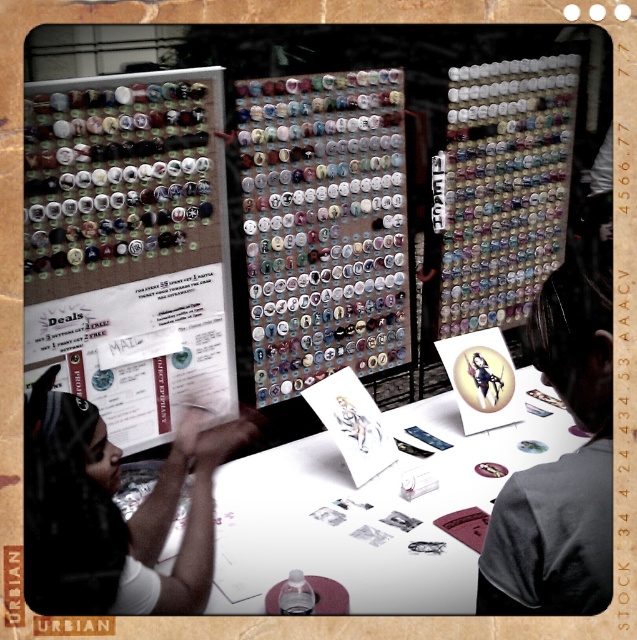
Locate an element on the screen. white paper at center is located at coordinates (376, 512).

Is point (431, 428) positioned behind point (592, 6)?

Yes, point (431, 428) is farther from viewer.

The height and width of the screenshot is (640, 637). Find the location of `white paper at center`. white paper at center is located at coordinates (376, 512).

In the scene shown: Between white paper at center and matte black shirt at left, which one is positioned higher?

matte black shirt at left is higher up.

Is point (404, 404) positioned in front of point (199, 595)?

No, it is not.

Identify the location of white paper at center. The image size is (637, 640). (376, 512).

Looking at this image, is white paper at center positioned behind matte black button at center?

Yes.

From the picture: Is white paper at center wider than matte black button at center?

Yes.

Image resolution: width=637 pixels, height=640 pixels. Describe the element at coordinates (376, 512) in the screenshot. I see `white paper at center` at that location.

Find the location of a particular element. white paper at center is located at coordinates (376, 512).